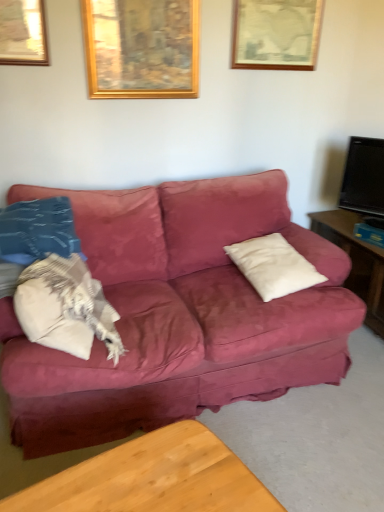
Question: Would you say gold wooden picture frame at upper center, arranged as the 2th picture frame when viewed from the right, is inside or outside wooden coffee table at lower center?

Choices:
 (A) outside
 (B) inside

Answer: (A)

Question: From the image's perspective, is gold wooden picture frame at upper center, which is counted as the first picture frame, starting from the left, located above or below wooden coffee table at lower center?

Choices:
 (A) above
 (B) below

Answer: (A)

Question: Which is nearer to the white soft pillow at left, the second pillow viewed from the right?

Choices:
 (A) black glossy tv at right
 (B) gold wooden picture frame at upper center, which is counted as the first picture frame, starting from the left
 (C) white soft pillow at center, which is counted as the second pillow, starting from the left
 (D) wooden framed picture at upper center, placed as the first picture frame when sorted from right to left
 (E) wooden coffee table at lower center

Answer: (E)

Question: Which object is the farthest from the black glossy tv at right?

Choices:
 (A) wooden coffee table at lower center
 (B) white soft pillow at left, the second pillow viewed from the right
 (C) white soft pillow at center, which is counted as the second pillow, starting from the left
 (D) wooden framed picture at upper center, positioned as the second picture frame in left-to-right order
 (E) gold wooden picture frame at upper center, arranged as the 2th picture frame when viewed from the right

Answer: (A)